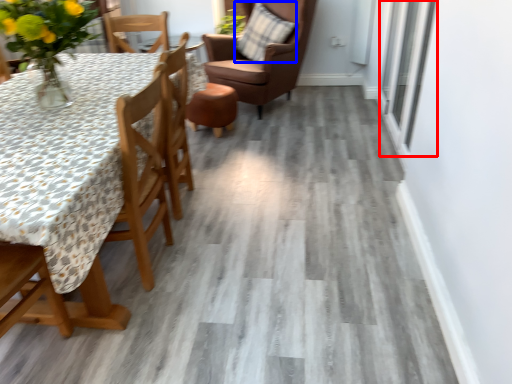
Question: Which of the following is the farthest to the observer, window (highlighted by a red box) or pillow (highlighted by a blue box)?

Choices:
 (A) window
 (B) pillow

Answer: (B)